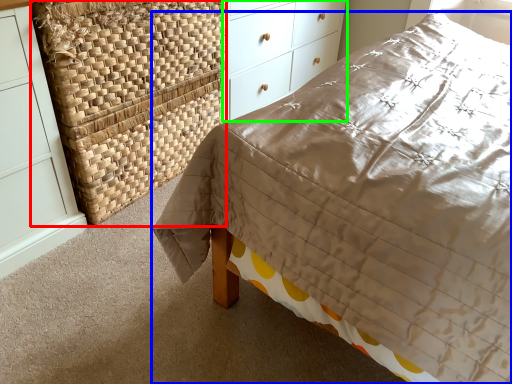
Question: Which is farther away from basket (highlighted by a red box)? bed (highlighted by a blue box) or chest of drawers (highlighted by a green box)?

Choices:
 (A) bed
 (B) chest of drawers

Answer: (A)